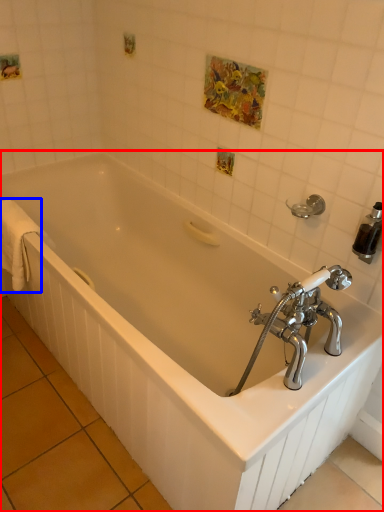
Question: Which point is closer to the camera, bathtub (highlighted by a red box) or bath towel (highlighted by a blue box)?

Choices:
 (A) bathtub
 (B) bath towel

Answer: (A)